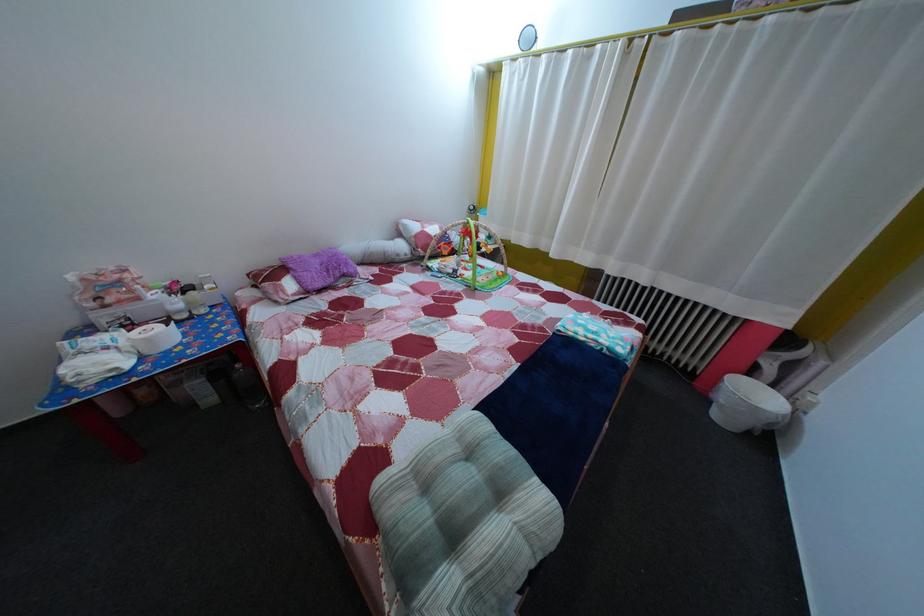
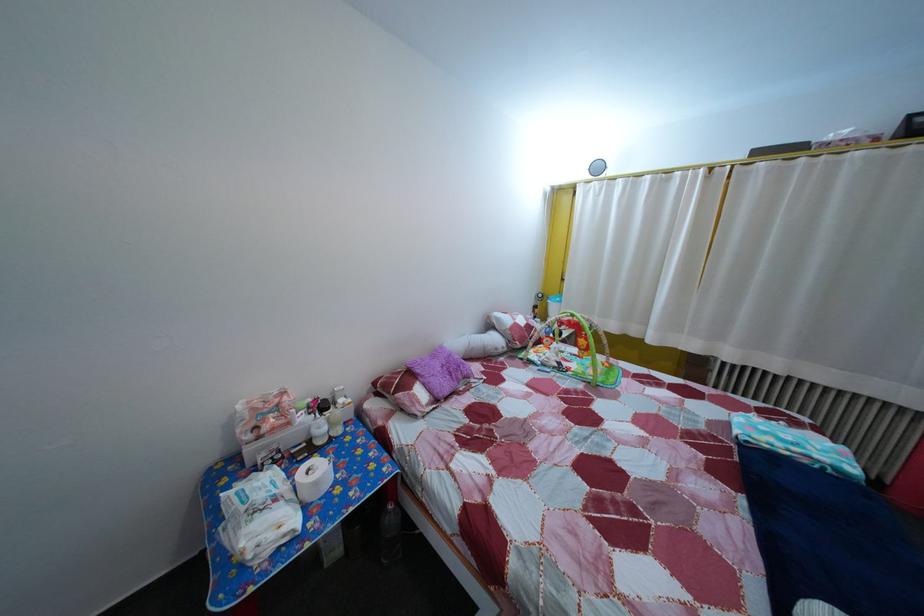
In the second image, find the point that corresponds to the point at 580,60 in the first image.

(659, 185)